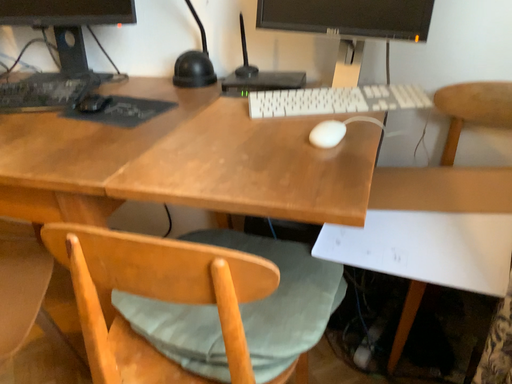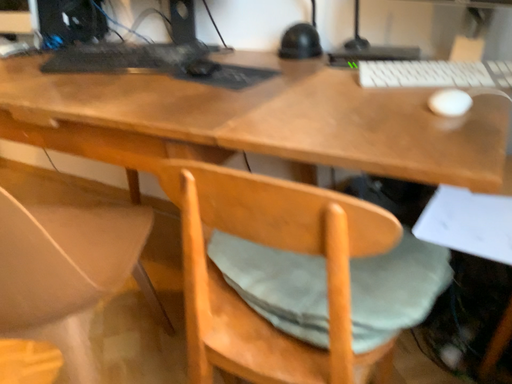
Question: How did the camera likely rotate when shooting the video?

Choices:
 (A) rotated right
 (B) rotated left

Answer: (B)